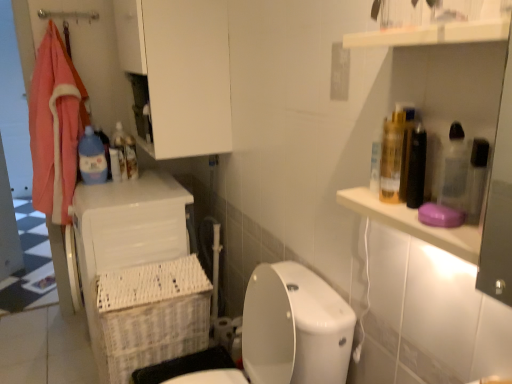
The width and height of the screenshot is (512, 384). I want to click on free spot above white plastic laundry basket at lower left (from a real-world perspective), so click(132, 184).